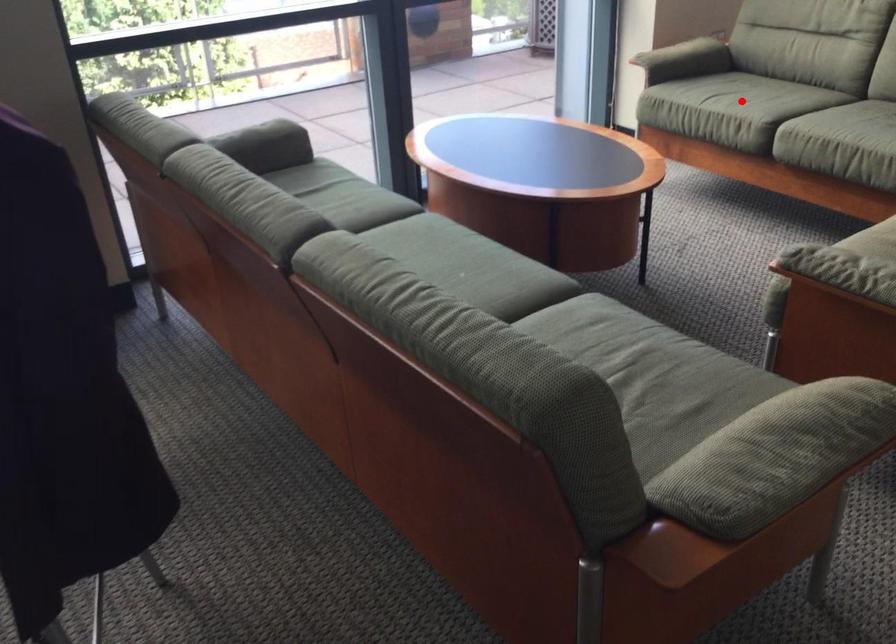
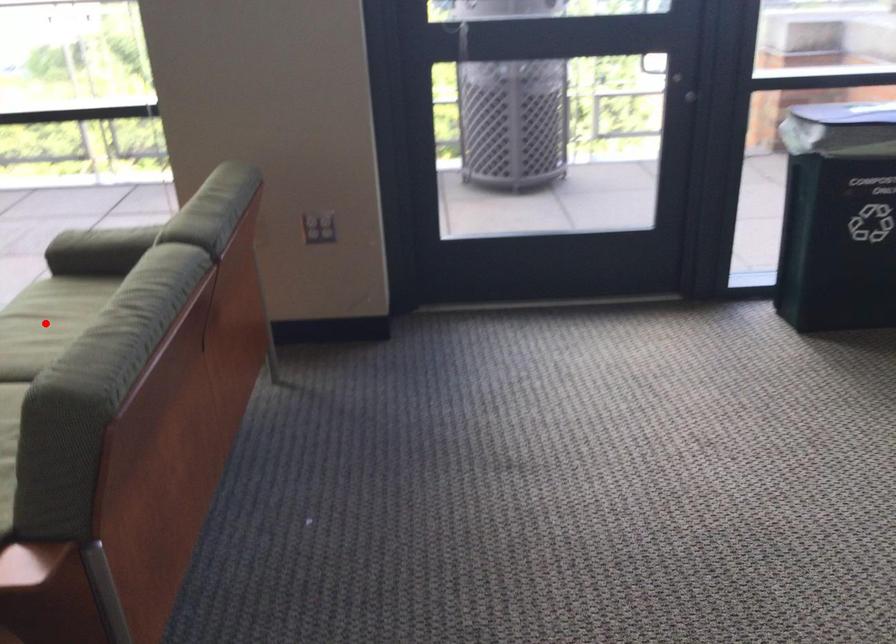
I am providing you with two images of the same scene from different viewpoints. A red point is marked on the first image and another point is marked on the second image. Do the highlighted points in image1 and image2 indicate the same real-world spot?

Yes